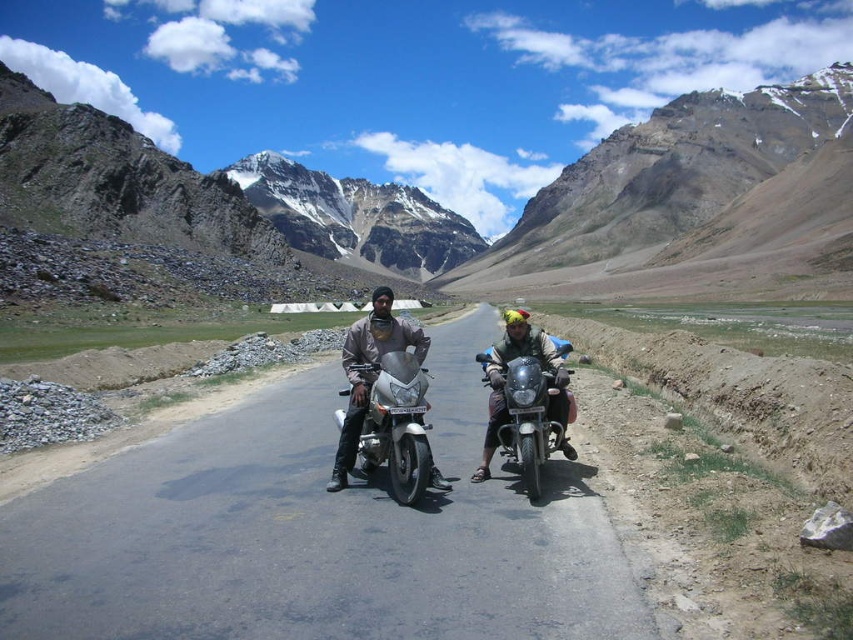
You are a hiker planning to take a photo of the rocky gray mountain at center and the silver metallic motorcycle at center from the road. Which object should you position yourself to the left of to ensure both are in the frame?

You should position yourself to the left of the silver metallic motorcycle at center because the rocky gray mountain at center is located to its right, allowing both objects to be captured in the frame when positioned this way.

You are a hiker planning to take a photo of both the rocky gray mountain at center and the rugged stone mountain at upper center. Based on their positions, which mountain should you position to your left side to include both in the frame?

You should position the rugged stone mountain at upper center to your left side because the rocky gray mountain at center is to the left of it, ensuring both mountains are included in the frame.

You are a hiker planning to cross the rocky terrain on the left side of the road. There is a point marked at coordinates [460,221] which indicates a rocky gray mountain at center. Can you safely walk directly towards that point from your current position on the left side of the road?

The point marked at [460,221] indicates a rocky gray mountain at center, so walking directly towards it from the left side of the road may be challenging due to the rocky terrain described in the scene. However, the exact navigability isn